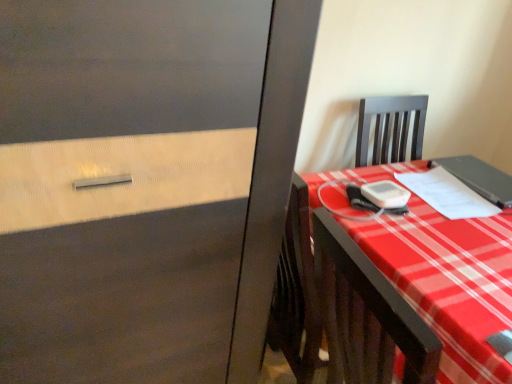
Question: From the image's perspective, is matte black notebook at right, which is counted as the first notebook, starting from the right, located above plaid fabric desk at right?

Choices:
 (A) yes
 (B) no

Answer: (A)

Question: Is matte black notebook at right, which is counted as the first notebook, starting from the right, further to camera compared to plaid fabric desk at right?

Choices:
 (A) yes
 (B) no

Answer: (A)

Question: Is plaid fabric desk at right located within matte black notebook at right, which is counted as the first notebook, starting from the right?

Choices:
 (A) yes
 (B) no

Answer: (B)

Question: Is matte black notebook at right, which ranks as the 2th notebook in left-to-right order, placed right next to plaid fabric desk at right?

Choices:
 (A) no
 (B) yes

Answer: (A)

Question: Can you confirm if matte black notebook at right, which ranks as the 2th notebook in left-to-right order, is wider than plaid fabric desk at right?

Choices:
 (A) no
 (B) yes

Answer: (A)

Question: Is matte black notebook at right, which is counted as the first notebook, starting from the right, in front of or behind plaid fabric desk at right in the image?

Choices:
 (A) behind
 (B) front

Answer: (A)

Question: From a real-world perspective, is matte black notebook at right, which is counted as the first notebook, starting from the right, above or below plaid fabric desk at right?

Choices:
 (A) above
 (B) below

Answer: (A)

Question: In terms of size, does matte black notebook at right, which ranks as the 2th notebook in left-to-right order, appear bigger or smaller than plaid fabric desk at right?

Choices:
 (A) big
 (B) small

Answer: (B)

Question: From their relative heights in the image, would you say matte black notebook at right, which is counted as the first notebook, starting from the right, is taller or shorter than plaid fabric desk at right?

Choices:
 (A) tall
 (B) short

Answer: (B)

Question: In the image, is plaid fabric desk at right positioned in front of or behind white paper at right, marked as the second notebook in a right-to-left arrangement?

Choices:
 (A) behind
 (B) front

Answer: (B)

Question: Looking at their shapes, would you say plaid fabric desk at right is wider or thinner than white paper at right, arranged as the 1th notebook when viewed from the left?

Choices:
 (A) wide
 (B) thin

Answer: (A)

Question: Would you say plaid fabric desk at right is to the left or to the right of white paper at right, arranged as the 1th notebook when viewed from the left, in the picture?

Choices:
 (A) right
 (B) left

Answer: (B)

Question: Considering the positions of point (391, 240) and point (453, 205), is point (391, 240) closer or farther from the camera than point (453, 205)?

Choices:
 (A) farther
 (B) closer

Answer: (B)

Question: Looking at their shapes, would you say matte black notebook at right, which is counted as the first notebook, starting from the right, is wider or thinner than white paper at right, arranged as the 1th notebook when viewed from the left?

Choices:
 (A) thin
 (B) wide

Answer: (B)

Question: Does point (485, 188) appear closer or farther from the camera than point (449, 205)?

Choices:
 (A) farther
 (B) closer

Answer: (A)